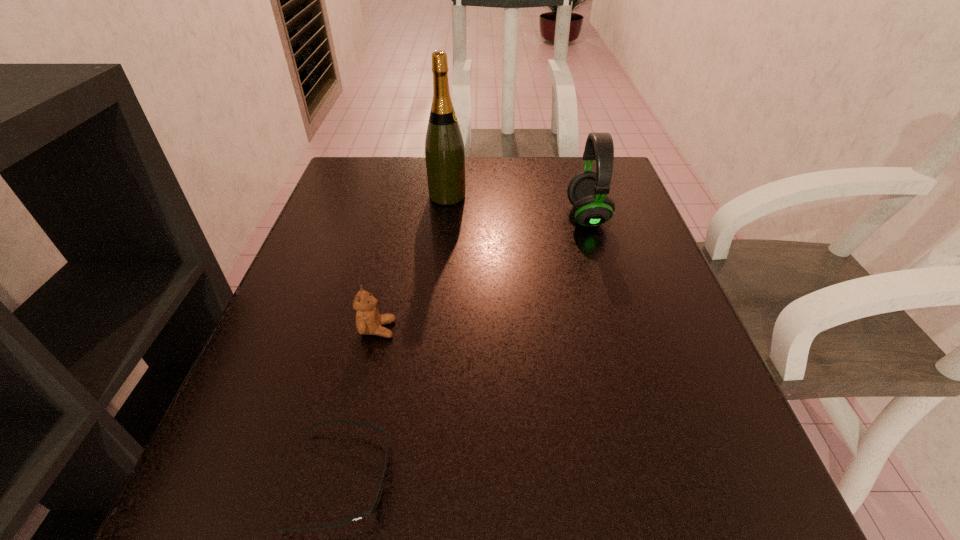
Identify the location of blank region between the third tallest object and the rightmost object. (482, 272).

Identify the location of unoccupied position between the third shortest object and the teddy bear. (482, 272).

Locate an element on the screen. This screenshot has width=960, height=540. vacant region between the second nearest object and the wine bottle is located at coordinates (413, 262).

Find the location of a particular element. The width and height of the screenshot is (960, 540). free space that is in between the second nearest object and the sunglasses is located at coordinates (360, 404).

Find the location of a particular element. This screenshot has width=960, height=540. vacant space in between the sunglasses and the rightmost object is located at coordinates (465, 347).

You are a GUI agent. You are given a task and a screenshot of the screen. Output one action in this format:
    pyautogui.click(x=<x>, y=<y>)
    Task: Click on the empty space that is in between the tallest object and the teddy bear
    
    Given the screenshot: What is the action you would take?
    coord(413,262)

The image size is (960, 540). I want to click on object that is the third closest to the nearest object, so click(444, 148).

Identify the location of the closest object to the third tallest object. (381, 480).